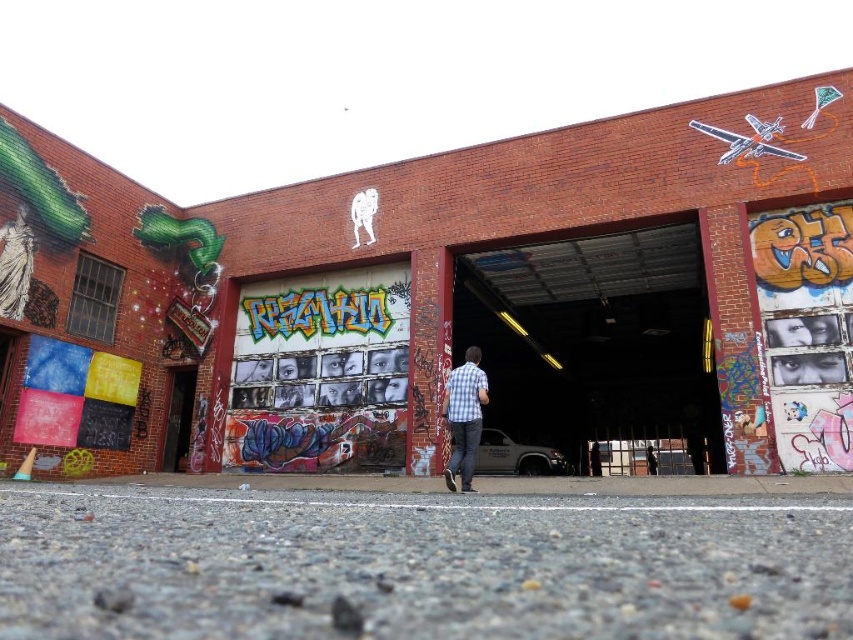
You are standing in front of the building and notice a specific point marked at coordinates (x=428, y=556). What is located at this point?

The point at coordinates (x=428, y=556) indicates gray asphalt at lower center.

You are a delivery person trying to park your 1.8 meter wide van in the gray asphalt at lower center. There is a person wearing a checkered shirt at center standing in the middle of the parking spot. Can you safely park your van there without hitting the person?

The gray asphalt at lower center might be wider than the checkered shirt at center. If the parking spot is indeed wider than 1.8 meters, you could maneuver around the person, but since their exact positions aren